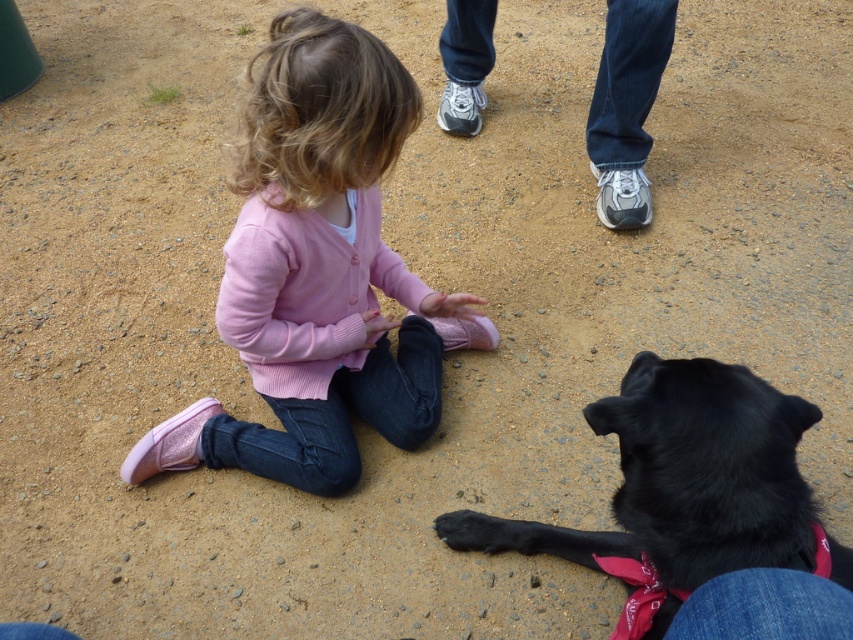
Question: Where is pink matte sweater at center located in relation to black fur dog at lower right in the image?

Choices:
 (A) below
 (B) above

Answer: (B)

Question: Can you confirm if pink matte sweater at center is thinner than black fur dog at lower right?

Choices:
 (A) yes
 (B) no

Answer: (B)

Question: Is pink matte sweater at center to the right of black fur dog at lower right from the viewer's perspective?

Choices:
 (A) no
 (B) yes

Answer: (A)

Question: Which object appears farthest from the camera in this image?

Choices:
 (A) black fur dog at lower right
 (B) pink matte sweater at center

Answer: (B)